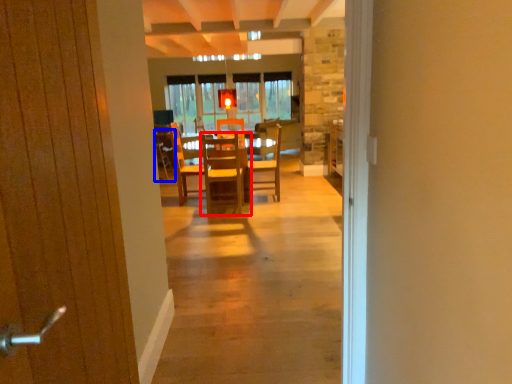
Question: Among these objects, which one is farthest to the camera, chair (highlighted by a red box) or armchair (highlighted by a blue box)?

Choices:
 (A) chair
 (B) armchair

Answer: (B)